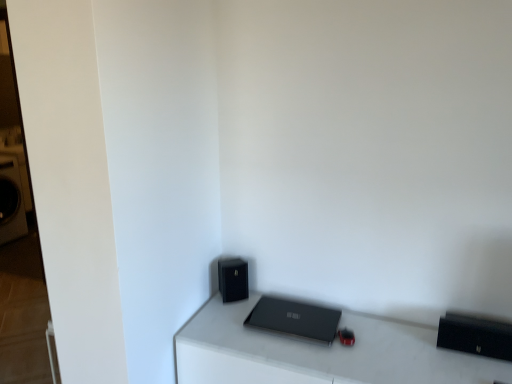
Identify the location of empty space that is ontop of matte black laptop at center. (366, 349).